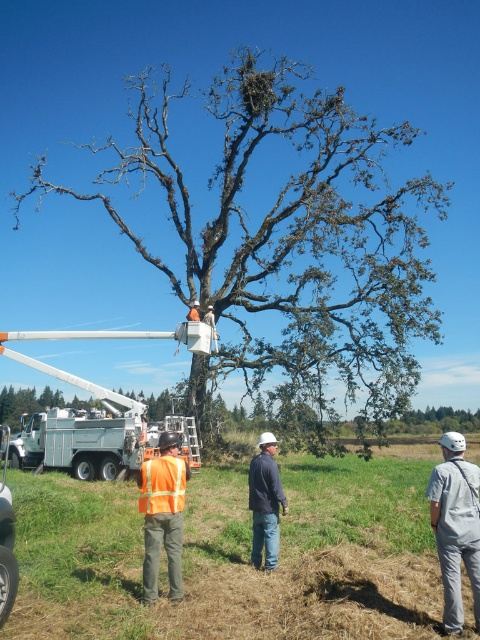
Based on the photo, you are a delivery drone operator. Your drone is currently hovering above the reflective orange vest at center and needs to deliver a package to the dark blue jeans at center. The drone has a maximum delivery range of 1.5 meters. Can the drone safely deliver the package without moving beyond its range?

The reflective orange vest at center is 1.54 meters from the dark blue jeans at center. Since the distance is slightly over the drone maximum range of 1.5 meters, the drone cannot safely deliver the package without moving beyond its range.

You are standing at the bottom left corner of the image where the person in the orange safety vest is located. You want to walk directly towards the green leafy tree at center. Which direction should you move relative to your current position?

To walk directly towards the green leafy tree at center from the bottom left corner, you should move towards the upper right direction since the tree is positioned at point [288,234] which is northeast relative to your starting point.